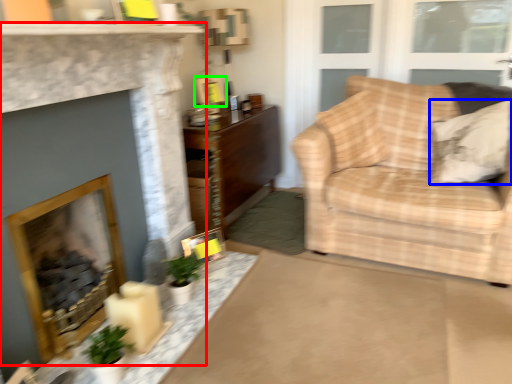
Question: Based on their relative distances, which object is nearer to fireplace (highlighted by a red box)? Choose from pillow (highlighted by a blue box) and picture frame (highlighted by a green box).

Choices:
 (A) pillow
 (B) picture frame

Answer: (B)